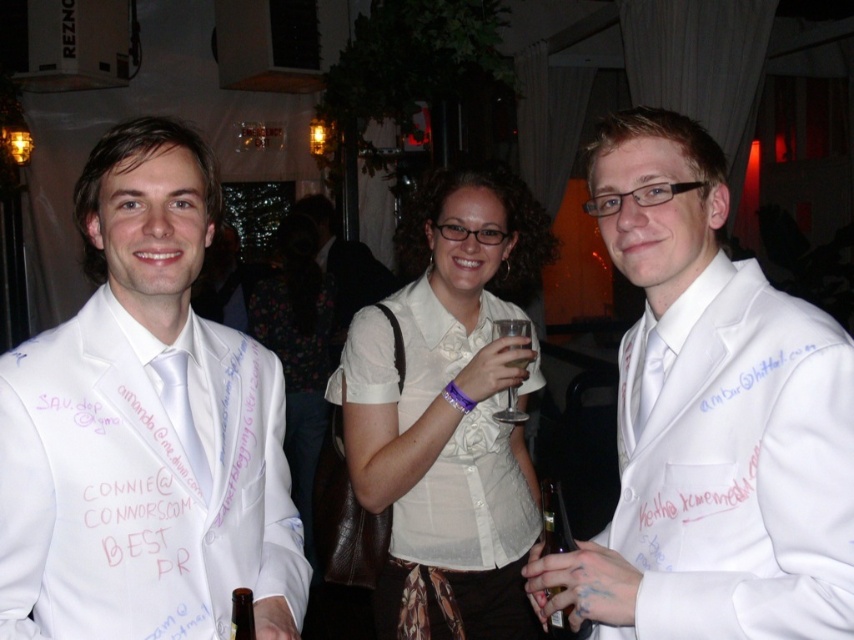
Where is `matte white suit at center`? matte white suit at center is located at coordinates (144, 428).

Can you confirm if matte white suit at center is positioned below white satin suit at center?

Indeed, matte white suit at center is positioned under white satin suit at center.

This screenshot has height=640, width=854. Describe the element at coordinates (144, 428) in the screenshot. I see `matte white suit at center` at that location.

Where is `matte white suit at center`? matte white suit at center is located at coordinates (144, 428).

Does matte white suit at center appear under brown glass bottle at lower left?

Actually, matte white suit at center is above brown glass bottle at lower left.

Is matte white suit at center in front of brown glass bottle at lower left?

No.

Measure the distance between matte white suit at center and camera.

The distance of matte white suit at center from camera is 39.23 inches.

What are the coordinates of `matte white suit at center` in the screenshot? It's located at [144, 428].

What are the coordinates of `translucent glass bottle at right` in the screenshot? It's located at (554, 520).

Does point (560, 506) lie behind point (249, 621)?

Yes, it is.

Which is behind, point (563, 544) or point (250, 632)?

Positioned behind is point (563, 544).

This screenshot has width=854, height=640. What are the coordinates of `translucent glass bottle at right` in the screenshot? It's located at (554, 520).